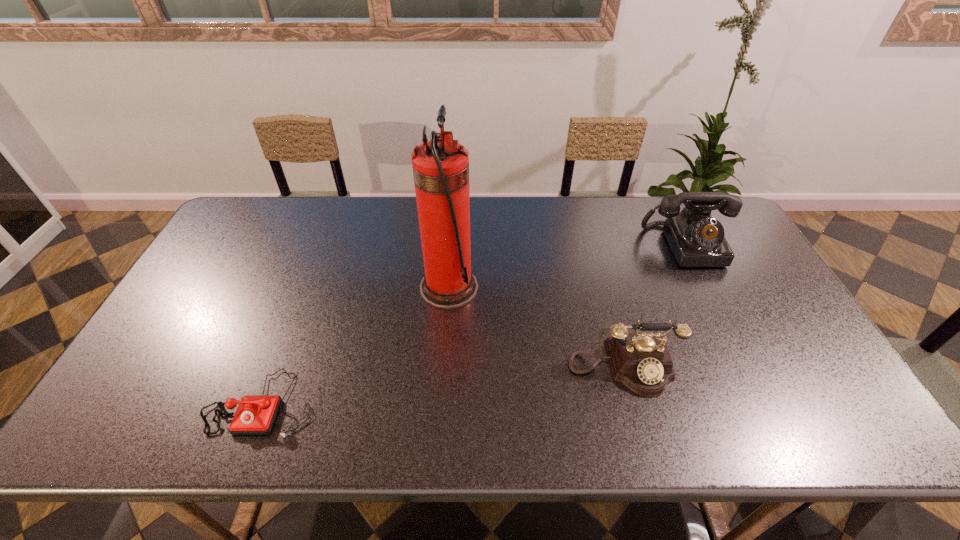
The height and width of the screenshot is (540, 960). Identify the location of the closest telephone to the leftmost telephone. (642, 362).

Find the location of `the closest telephone to the shortest telephone`. the closest telephone to the shortest telephone is located at coordinates click(x=642, y=362).

Where is `free space in the image that satisfies the following two spatial constraints: 1. at the discharge end of the fire extinguisher; 2. on the dial of the shortest telephone`? Image resolution: width=960 pixels, height=540 pixels. free space in the image that satisfies the following two spatial constraints: 1. at the discharge end of the fire extinguisher; 2. on the dial of the shortest telephone is located at coordinates (441, 403).

Where is `vacant space that satisfies the following two spatial constraints: 1. at the discharge end of the third object from right to left; 2. on the dial of the leftmost object`? This screenshot has width=960, height=540. vacant space that satisfies the following two spatial constraints: 1. at the discharge end of the third object from right to left; 2. on the dial of the leftmost object is located at coordinates (441, 403).

Where is `vacant region that satisfies the following two spatial constraints: 1. at the discharge end of the second object from left to right; 2. on the dial of the shortest telephone`? Image resolution: width=960 pixels, height=540 pixels. vacant region that satisfies the following two spatial constraints: 1. at the discharge end of the second object from left to right; 2. on the dial of the shortest telephone is located at coordinates (441, 403).

The height and width of the screenshot is (540, 960). I want to click on free spot that satisfies the following two spatial constraints: 1. at the discharge end of the fire extinguisher; 2. on the dial of the leftmost telephone, so click(x=441, y=403).

The width and height of the screenshot is (960, 540). I want to click on free space that satisfies the following two spatial constraints: 1. on the dial of the rightmost object; 2. at the discharge end of the second object from left to right, so click(708, 288).